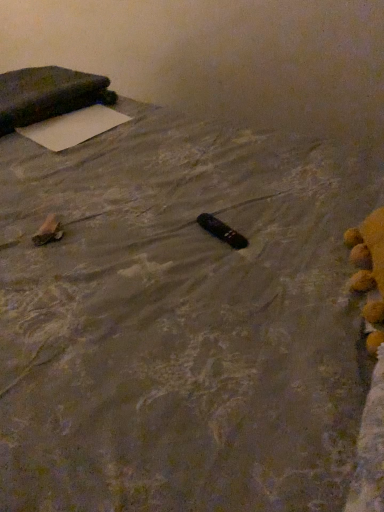
Question: Is dark fabric pillow at upper left outside of brown paper bag at lower left, the 1th waste in the left-to-right sequence?

Choices:
 (A) no
 (B) yes

Answer: (B)

Question: From the image's perspective, would you say dark fabric pillow at upper left is positioned over brown paper bag at lower left, the second waste when ordered from right to left?

Choices:
 (A) yes
 (B) no

Answer: (A)

Question: Does dark fabric pillow at upper left have a lesser height compared to brown paper bag at lower left, the second waste when ordered from right to left?

Choices:
 (A) yes
 (B) no

Answer: (B)

Question: Is dark fabric pillow at upper left placed right next to brown paper bag at lower left, the second waste when ordered from right to left?

Choices:
 (A) no
 (B) yes

Answer: (A)

Question: From the image's perspective, is dark fabric pillow at upper left under brown paper bag at lower left, the 1th waste in the left-to-right sequence?

Choices:
 (A) yes
 (B) no

Answer: (B)

Question: In terms of height, does white matte yoga mat at upper left look taller or shorter compared to black plastic remote at center, which appears as the 2th waste when viewed from the left?

Choices:
 (A) short
 (B) tall

Answer: (A)

Question: From a real-world perspective, relative to black plastic remote at center, which appears as the 2th waste when viewed from the left, is white matte yoga mat at upper left vertically above or below?

Choices:
 (A) below
 (B) above

Answer: (B)

Question: From the image's perspective, is white matte yoga mat at upper left positioned above or below black plastic remote at center, which appears as the 2th waste when viewed from the left?

Choices:
 (A) above
 (B) below

Answer: (A)

Question: In the image, is white matte yoga mat at upper left positioned in front of or behind black plastic remote at center, which appears as the 2th waste when viewed from the left?

Choices:
 (A) behind
 (B) front

Answer: (A)

Question: In the image, is black plastic remote at center, marked as the 1th waste in a right-to-left arrangement, positioned in front of or behind brown paper bag at lower left, the 1th waste in the left-to-right sequence?

Choices:
 (A) behind
 (B) front

Answer: (A)

Question: From a real-world perspective, is black plastic remote at center, marked as the 1th waste in a right-to-left arrangement, above or below brown paper bag at lower left, the 1th waste in the left-to-right sequence?

Choices:
 (A) below
 (B) above

Answer: (A)

Question: Is point (223, 240) positioned closer to the camera than point (51, 241)?

Choices:
 (A) farther
 (B) closer

Answer: (A)

Question: Would you say black plastic remote at center, marked as the 1th waste in a right-to-left arrangement, is inside or outside brown paper bag at lower left, the 1th waste in the left-to-right sequence?

Choices:
 (A) outside
 (B) inside

Answer: (A)

Question: Considering their positions, is white matte yoga mat at upper left located in front of or behind dark fabric pillow at upper left?

Choices:
 (A) behind
 (B) front

Answer: (B)

Question: Is point (97, 133) positioned closer to the camera than point (69, 97)?

Choices:
 (A) farther
 (B) closer

Answer: (B)